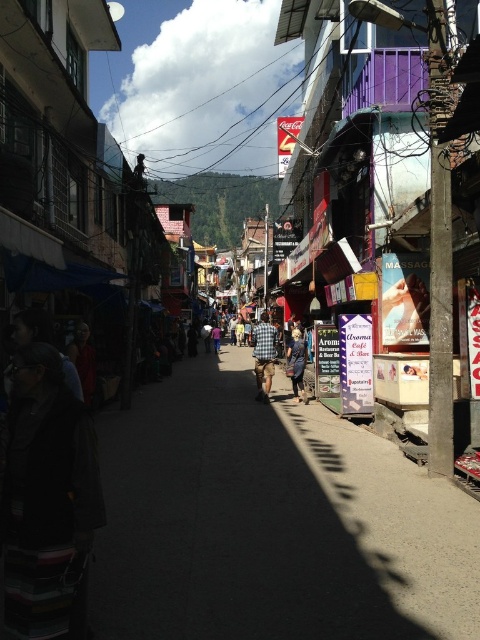
Is concrete sidewalk at center wider than plaid shirt at center?

Yes, concrete sidewalk at center is wider than plaid shirt at center.

Is concrete sidewalk at center bigger than plaid shirt at center?

Correct, concrete sidewalk at center is larger in size than plaid shirt at center.

Where is `concrete sidewalk at center`? concrete sidewalk at center is located at coordinates (272, 522).

Find the location of a particular element. This screenshot has height=640, width=480. concrete sidewalk at center is located at coordinates (272, 522).

Which is above, dark brown monk at center or plaid shirt at center?

Positioned higher is dark brown monk at center.

How distant is dark brown monk at center from plaid shirt at center?

The distance of dark brown monk at center from plaid shirt at center is 21.78 feet.

Measure the distance between point [84,397] and camera.

The distance of point [84,397] from camera is 9.61 meters.

You are a GUI agent. You are given a task and a screenshot of the screen. Output one action in this format:
    pyautogui.click(x=<x>, y=<y>)
    Task: Click on the dark brown monk at center
    Image resolution: width=480 pixels, height=640 pixels.
    Given the screenshot: What is the action you would take?
    pos(84,360)

Is checkered fabric shirt at center taller than plaid shirt at center?

Yes.

Is point (266, 364) behind point (307, 401)?

No, (266, 364) is closer to viewer.

At what (x,y) coordinates should I click in order to perform the action: click on checkered fabric shirt at center. Please return your answer as a coordinate pair (x, y). Looking at the image, I should click on (264, 355).

Find the location of `checkered fabric shirt at center`. checkered fabric shirt at center is located at coordinates (264, 355).